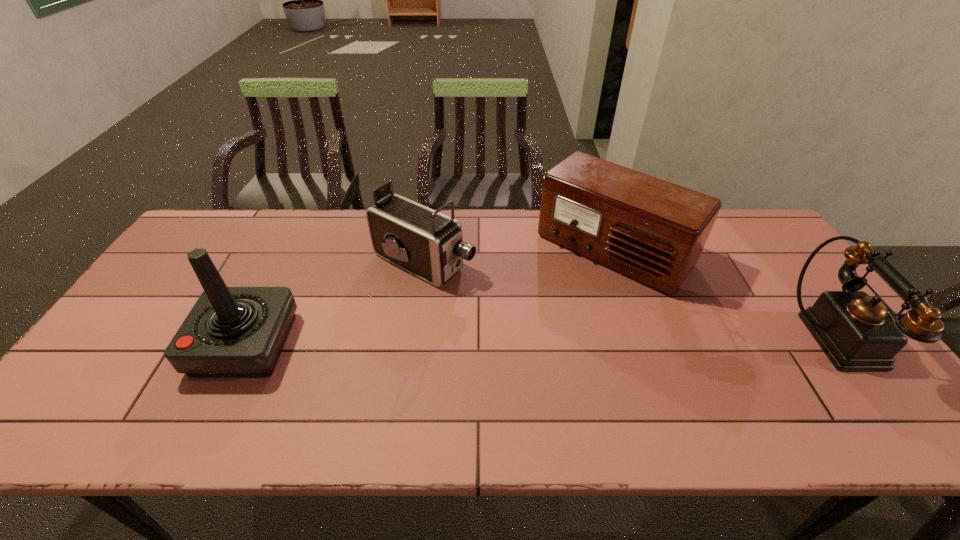
You are a GUI agent. You are given a task and a screenshot of the screen. Output one action in this format:
    pyautogui.click(x=<x>, y=<y>)
    Task: Click on the vacant point located between the joystick and the second object from right to left
    
    Given the screenshot: What is the action you would take?
    pyautogui.click(x=429, y=297)

I want to click on vacant space that is in between the camcorder and the telephone, so point(628,300).

This screenshot has width=960, height=540. I want to click on free point between the camcorder and the rightmost object, so click(628, 300).

Locate an element on the screen. This screenshot has height=540, width=960. empty space between the radio receiver and the tallest object is located at coordinates tap(429, 297).

Where is `empty location between the camcorder and the leftmost object`? empty location between the camcorder and the leftmost object is located at coordinates (335, 303).

Locate an element on the screen. This screenshot has height=540, width=960. blank region between the joystick and the telephone is located at coordinates (539, 341).

Locate which object ranks in proximity to the telephone. Please provide its 2D coordinates. Your answer should be formatted as a tuple, i.e. [(x, y)], where the tuple contains the x and y coordinates of a point satisfying the conditions above.

[(653, 231)]

Locate an element on the screen. object that is the third closest one to the third object from right to left is located at coordinates (856, 332).